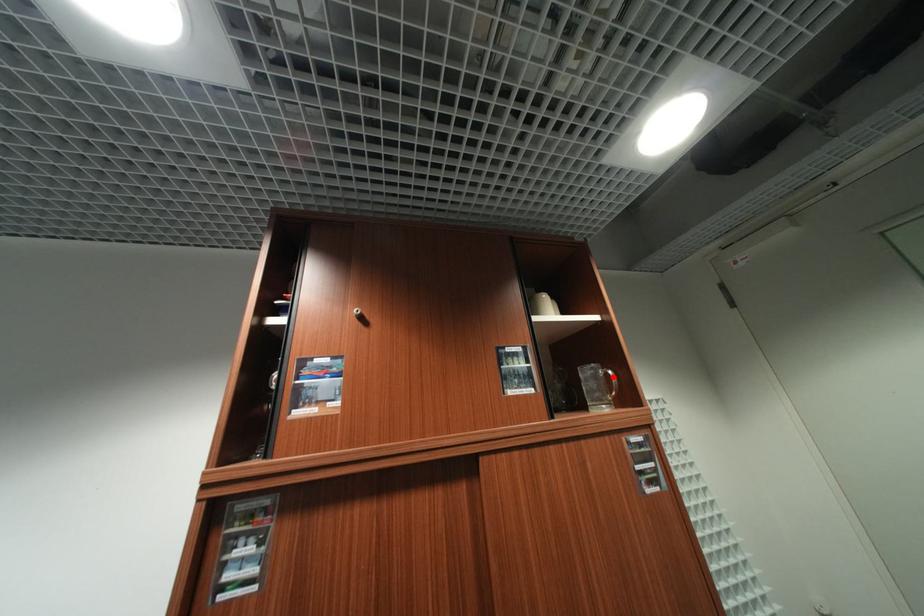
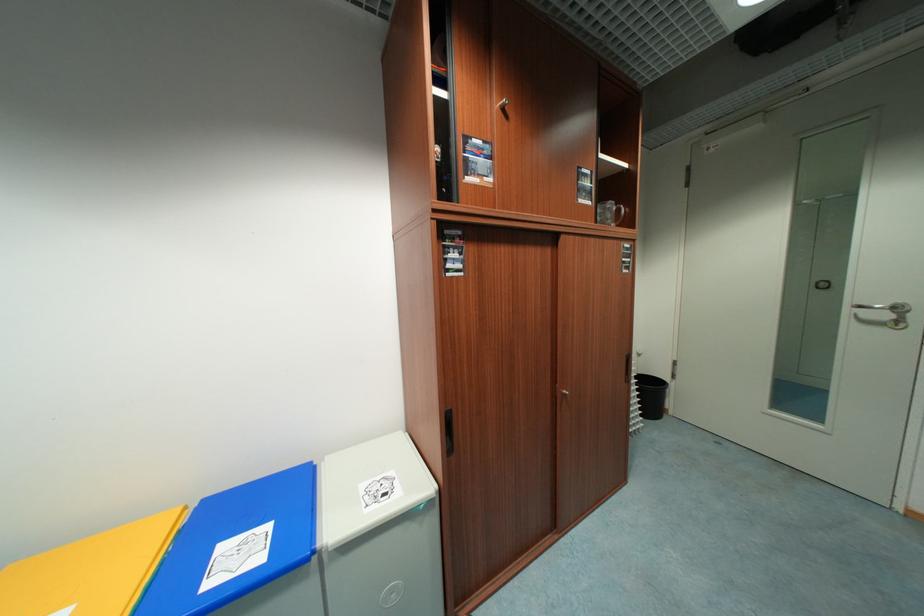
In the second image, find the point that corresponds to the highlighted location in the first image.

(624, 211)